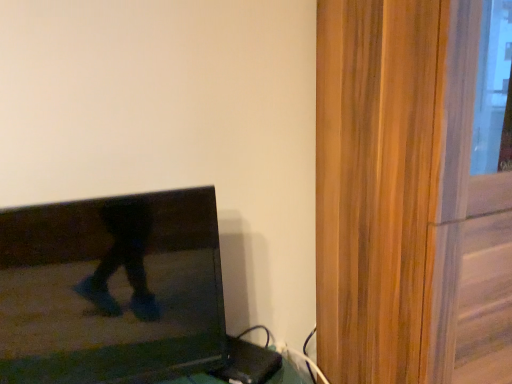
Question: From the image's perspective, relative to matte black tv at left, is wooden screen door at right above or below?

Choices:
 (A) below
 (B) above

Answer: (B)

Question: Is wooden screen door at right wider or thinner than matte black tv at left?

Choices:
 (A) thin
 (B) wide

Answer: (B)

Question: In the image, is wooden screen door at right positioned in front of or behind matte black tv at left?

Choices:
 (A) behind
 (B) front

Answer: (B)

Question: Which is correct: matte black tv at left is inside wooden screen door at right, or outside of it?

Choices:
 (A) inside
 (B) outside

Answer: (B)

Question: Does point (195, 268) appear closer or farther from the camera than point (360, 221)?

Choices:
 (A) farther
 (B) closer

Answer: (B)

Question: From the image's perspective, is matte black tv at left above or below wooden screen door at right?

Choices:
 (A) above
 (B) below

Answer: (B)

Question: Relative to wooden screen door at right, is matte black tv at left in front or behind?

Choices:
 (A) front
 (B) behind

Answer: (B)